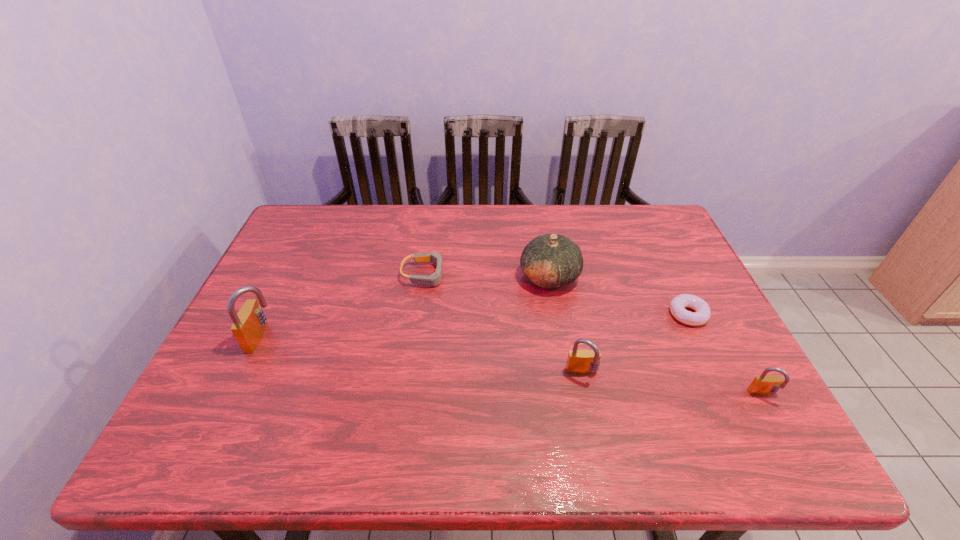
Identify the location of free area in between the fifth object from right to left and the rightmost padlock. This screenshot has height=540, width=960. (594, 335).

The width and height of the screenshot is (960, 540). Find the location of `object identified as the closest to the gourd`. object identified as the closest to the gourd is located at coordinates (434, 279).

You are a GUI agent. You are given a task and a screenshot of the screen. Output one action in this format:
    pyautogui.click(x=<x>, y=<y>)
    Task: Click on the object that ranks as the third closest to the second object from left to right
    
    Given the screenshot: What is the action you would take?
    pyautogui.click(x=581, y=362)

Locate an element on the screen. The width and height of the screenshot is (960, 540). padlock object that ranks as the closest to the second nearest padlock is located at coordinates (764, 384).

Select which padlock is the second closest to the third shortest object. Please provide its 2D coordinates. Your answer should be formatted as a tuple, i.e. [(x, y)], where the tuple contains the x and y coordinates of a point satisfying the conditions above.

[(249, 324)]

At what (x,y) coordinates should I click in order to perform the action: click on free point that satisfies the following two spatial constraints: 1. on the front and back of the doughnut; 2. on the right side of the goggles. Please return your answer as a coordinate pair (x, y). Looking at the image, I should click on (420, 315).

I want to click on free location that satisfies the following two spatial constraints: 1. on the back side of the gourd; 2. on the front and back of the second object from left to right, so click(549, 274).